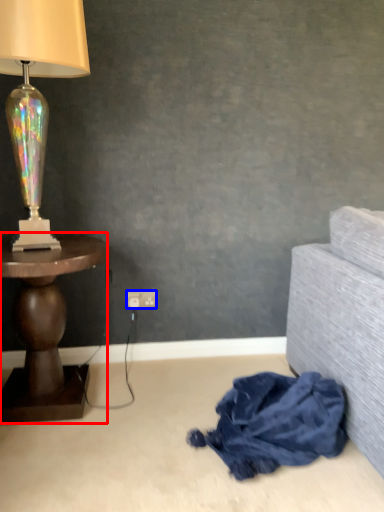
Question: Which object appears farthest to the camera in this image, table (highlighted by a red box) or power outlet (highlighted by a blue box)?

Choices:
 (A) table
 (B) power outlet

Answer: (B)